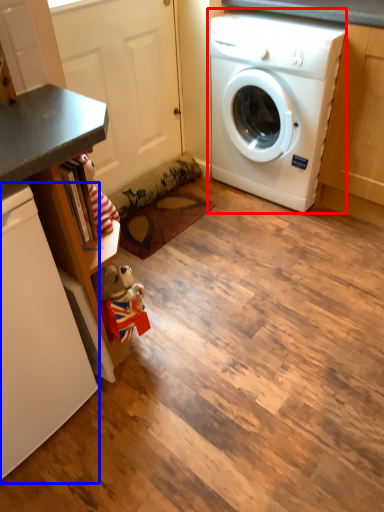
Question: Among these objects, which one is nearest to the camera, washing machine (highlighted by a red box) or dish washer (highlighted by a blue box)?

Choices:
 (A) washing machine
 (B) dish washer

Answer: (B)